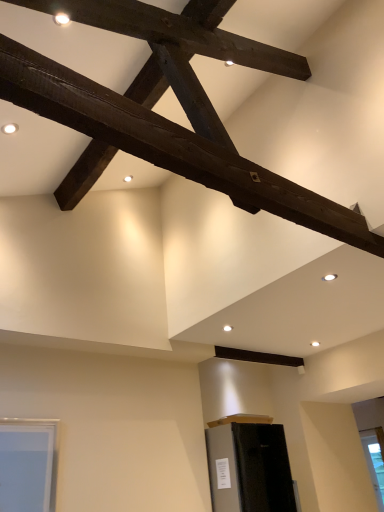
Question: From a real-world perspective, does matte black refrigerator at lower center stand above dark brown wood beam at upper center?

Choices:
 (A) no
 (B) yes

Answer: (A)

Question: Is matte black refrigerator at lower center facing away from dark brown wood beam at upper center?

Choices:
 (A) yes
 (B) no

Answer: (B)

Question: Is matte black refrigerator at lower center thinner than dark brown wood beam at upper center?

Choices:
 (A) no
 (B) yes

Answer: (B)

Question: From the image's perspective, is matte black refrigerator at lower center under dark brown wood beam at upper center?

Choices:
 (A) yes
 (B) no

Answer: (A)

Question: Is the depth of matte black refrigerator at lower center greater than that of dark brown wood beam at upper center?

Choices:
 (A) yes
 (B) no

Answer: (A)

Question: From the image's perspective, would you say matte black refrigerator at lower center is positioned over dark brown wood beam at upper center?

Choices:
 (A) no
 (B) yes

Answer: (A)

Question: From the image's perspective, is dark brown wood beam at upper center located beneath matte black refrigerator at lower center?

Choices:
 (A) no
 (B) yes

Answer: (A)

Question: Is dark brown wood beam at upper center surrounding matte black refrigerator at lower center?

Choices:
 (A) no
 (B) yes

Answer: (A)

Question: From the image's perspective, is dark brown wood beam at upper center located above matte black refrigerator at lower center?

Choices:
 (A) no
 (B) yes

Answer: (B)

Question: Does dark brown wood beam at upper center appear on the left side of matte black refrigerator at lower center?

Choices:
 (A) yes
 (B) no

Answer: (A)

Question: Is dark brown wood beam at upper center far away from matte black refrigerator at lower center?

Choices:
 (A) no
 (B) yes

Answer: (B)

Question: From a real-world perspective, is dark brown wood beam at upper center under matte black refrigerator at lower center?

Choices:
 (A) no
 (B) yes

Answer: (A)

Question: Is clear glass window at lower right oriented away from dark brown wood beam at upper center?

Choices:
 (A) no
 (B) yes

Answer: (A)